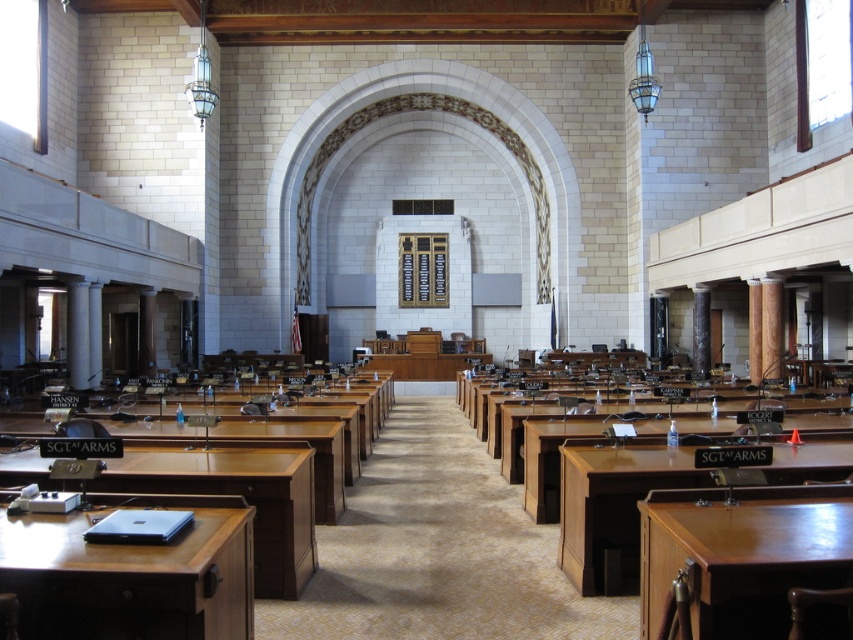
Question: Is brown wood table at lower left above brown wood table at center?

Choices:
 (A) yes
 (B) no

Answer: (A)

Question: Can you confirm if mahogany wood table at lower right is positioned to the right of wooden desk at center?

Choices:
 (A) yes
 (B) no

Answer: (A)

Question: Among these points, which one is farthest from the camera?

Choices:
 (A) (546, 486)
 (B) (786, 624)
 (C) (42, 612)

Answer: (A)

Question: Which object appears farthest from the camera in this image?

Choices:
 (A) wooden desk at center
 (B) brown polished wood table at lower right
 (C) brown wood table at center
 (D) brown wood table at lower left

Answer: (C)

Question: Can you confirm if matte brown desk at lower left is thinner than mahogany wood table at lower right?

Choices:
 (A) yes
 (B) no

Answer: (B)

Question: Which of the following is the farthest from the observer?

Choices:
 (A) (834, 476)
 (B) (129, 592)
 (C) (265, 474)

Answer: (A)